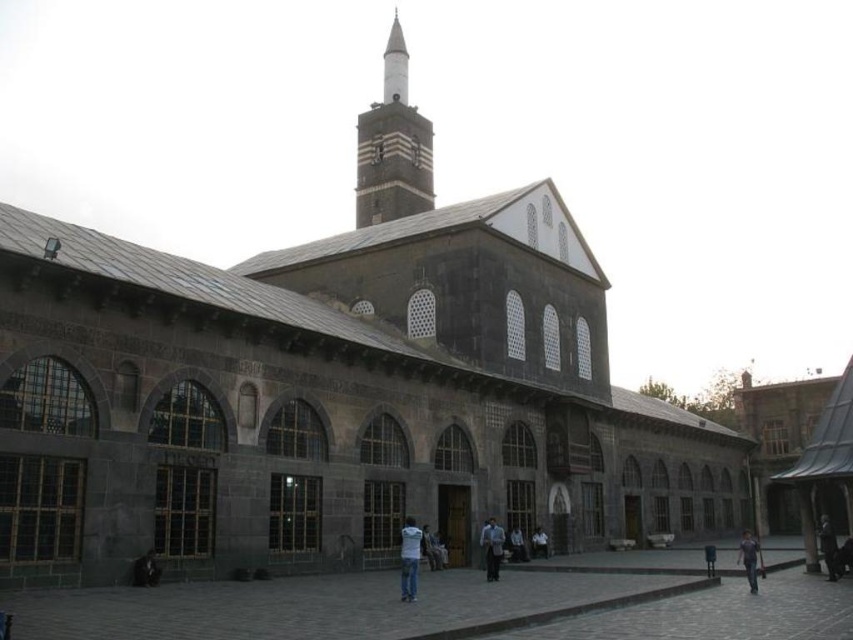
You are standing in front of the historic building and notice the dark brown stone minaret at center and the dark gray fabric coat at lower right. Which object is positioned higher from the ground?

The dark brown stone minaret at center is located above the dark gray fabric coat at lower right, so it is positioned higher from the ground.

You are a tailor who needs to determine which garment has a larger width to decide on fabric requirements. You observe the white cotton shirt at center and the light blue denim jacket at center in the image. Which garment has a greater width?

The white cotton shirt at center has a greater width than the light blue denim jacket at center according to the description.

From the picture: You are standing in front of the historic building and want to place a small potted plant between the gray stone courtyard at center and the dark gray fabric coat at lower right. Based on their positions, which object should the plant be nearer to?

The gray stone courtyard at center is closer to the viewer than the dark gray fabric coat at lower right, so the plant should be placed nearer to the dark gray fabric coat at lower right to maintain the spatial relationship between the two objects.